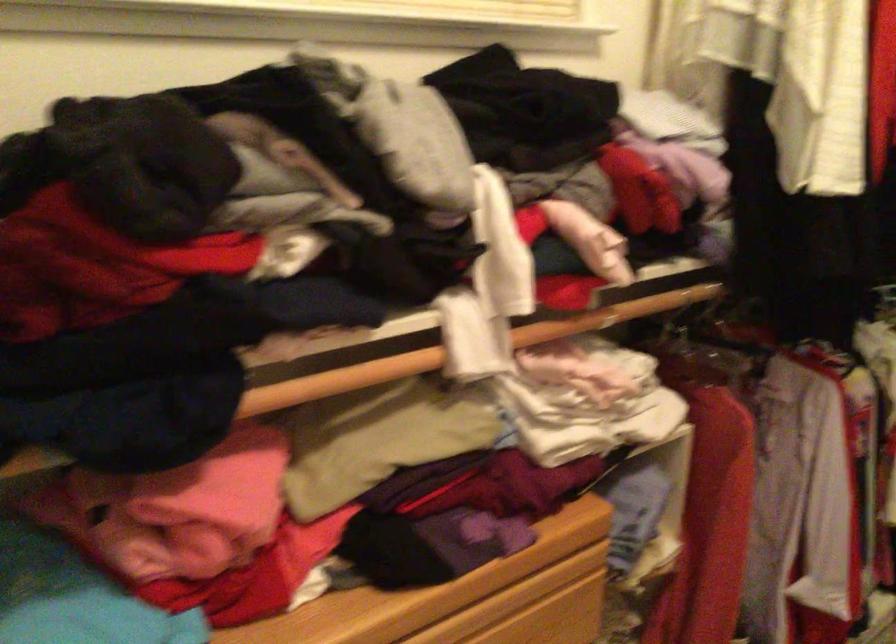
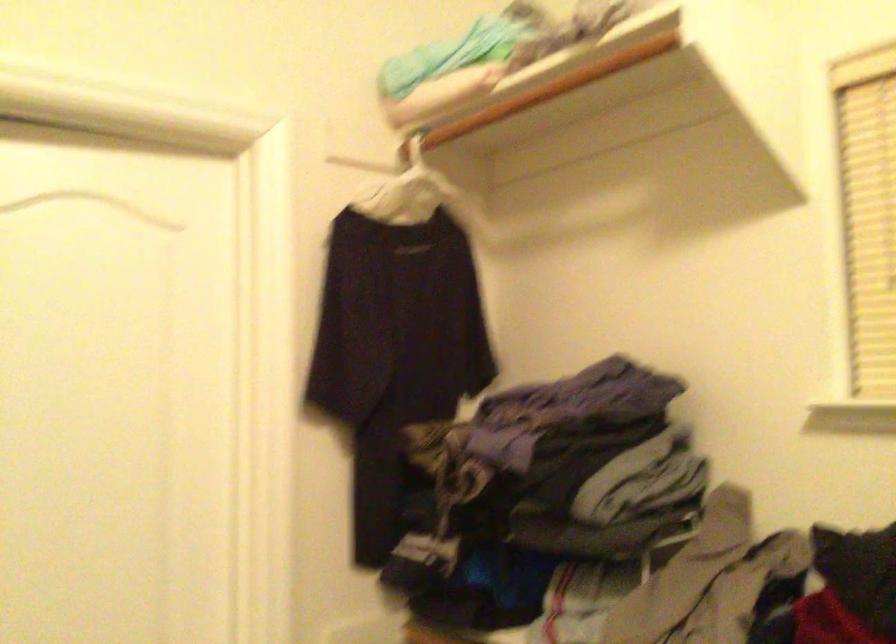
Question: The first image is from the beginning of the video and the second image is from the end. How did the camera likely rotate when shooting the video?

Choices:
 (A) Left
 (B) Right
 (C) Up
 (D) Down

Answer: (A)